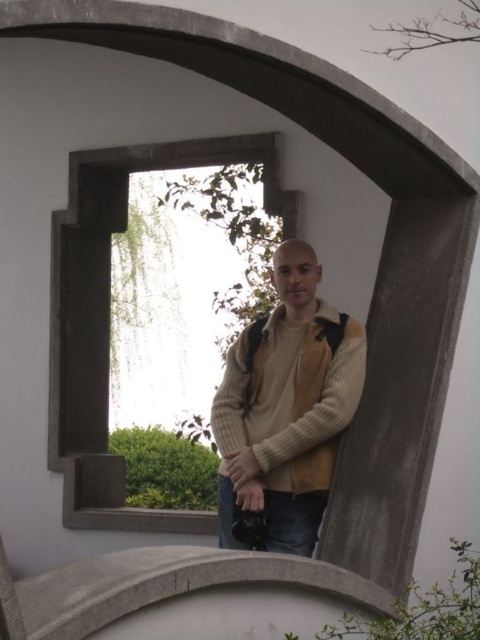
You are an interior designer assessing the placement of items in a courtyard. You notice the stone window frame at center and the knit sweater at center. Which object is closer to the viewer?

The stone window frame at center is closer to the viewer because the knit sweater at center is behind it.

You are a photographer standing in front of the stone window frame at center and the knit sweater at center. If you want to capture both objects in a single photo, which one should you zoom in on to ensure both fit in the frame?

You should zoom in on the knit sweater at center because the stone window frame at center is wider, so focusing on the smaller knit sweater at center will help both fit within the camera frame.